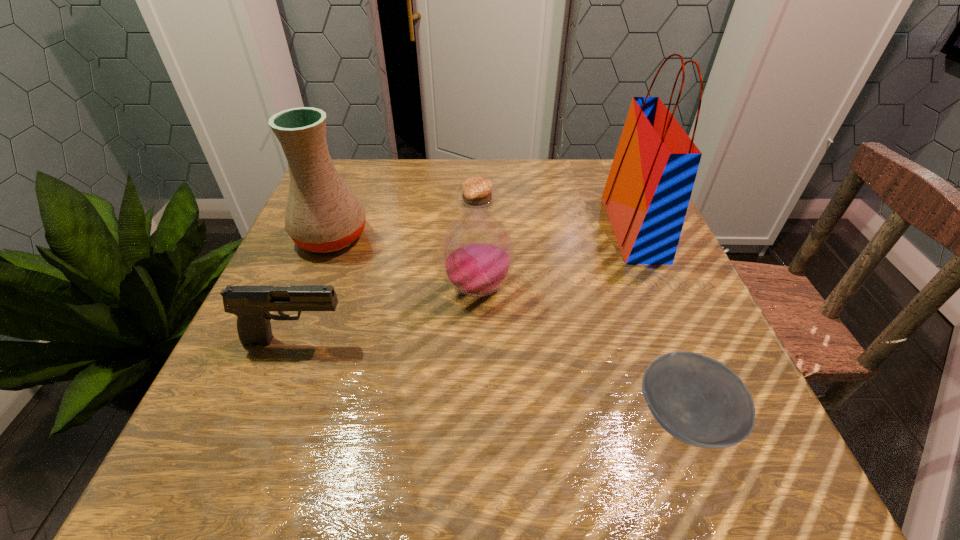
At what (x,y) coordinates should I click in order to perform the action: click on bowl at the right edge. Please return your answer as a coordinate pair (x, y). Looking at the image, I should click on (698, 400).

You are a GUI agent. You are given a task and a screenshot of the screen. Output one action in this format:
    pyautogui.click(x=<x>, y=<y>)
    Task: Click on the object at the far right corner
    This screenshot has width=960, height=540.
    Given the screenshot: What is the action you would take?
    pyautogui.click(x=647, y=193)

This screenshot has height=540, width=960. Find the location of `object at the near right corner`. object at the near right corner is located at coordinates (698, 400).

You are a GUI agent. You are given a task and a screenshot of the screen. Output one action in this format:
    pyautogui.click(x=<x>, y=<y>)
    Task: Click on the free region at the far edge of the desktop
    Image resolution: width=960 pixels, height=540 pixels.
    Given the screenshot: What is the action you would take?
    (507, 160)

I want to click on vacant area at the left edge, so click(311, 332).

This screenshot has width=960, height=540. What are the coordinates of `vacant space at the right edge of the desktop` in the screenshot? It's located at (615, 303).

Image resolution: width=960 pixels, height=540 pixels. I want to click on vacant space at the far left corner, so click(x=363, y=161).

In the image, there is a desktop. Where is `vacant space at the near left corner`? vacant space at the near left corner is located at coordinates (254, 442).

You are a GUI agent. You are given a task and a screenshot of the screen. Output one action in this format:
    pyautogui.click(x=<x>, y=<y>)
    Task: Click on the vacant space at the far right corner of the desktop
    This screenshot has width=960, height=540.
    Given the screenshot: What is the action you would take?
    pyautogui.click(x=594, y=174)

Locate an element on the screen. The height and width of the screenshot is (540, 960). free space between the bottle and the fourth farthest object is located at coordinates (387, 314).